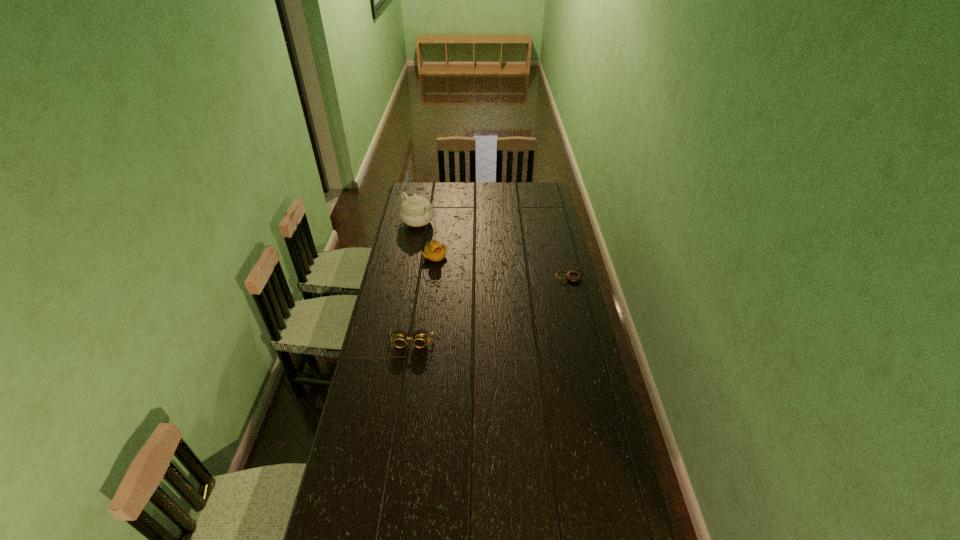
The width and height of the screenshot is (960, 540). I want to click on empty space between the tallest object and the pocket watch, so click(493, 248).

Where is `free space between the duckling and the chinaware`? Image resolution: width=960 pixels, height=540 pixels. free space between the duckling and the chinaware is located at coordinates coord(426,239).

Identify the location of free space between the pocket watch and the goggles. (491, 308).

The height and width of the screenshot is (540, 960). What are the coordinates of `object that can be found as the second closest to the nearest object` in the screenshot? It's located at (572, 276).

Identify which object is located as the nearest to the farthest object. Please provide its 2D coordinates. Your answer should be formatted as a tuple, i.e. [(x, y)], where the tuple contains the x and y coordinates of a point satisfying the conditions above.

[(433, 251)]

Where is `blank space that satisfies the following two spatial constraints: 1. on the front side of the third shortest object; 2. on the right side of the pocket watch`? The width and height of the screenshot is (960, 540). blank space that satisfies the following two spatial constraints: 1. on the front side of the third shortest object; 2. on the right side of the pocket watch is located at coordinates (433, 273).

Find the location of a particular element. vacant region that satisfies the following two spatial constraints: 1. on the front side of the shortest object; 2. on the right side of the third shortest object is located at coordinates (433, 273).